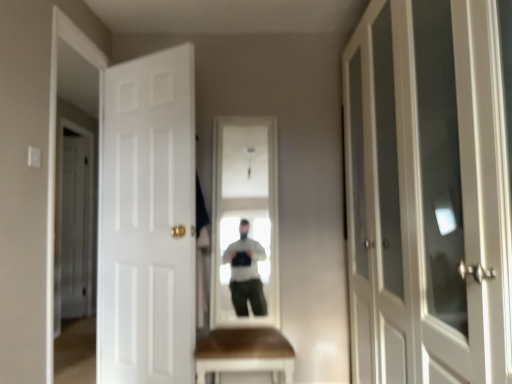
Measure the distance between white matte door at left, the 2th door positioned from the right, and camera.

A distance of 2.21 meters exists between white matte door at left, the 2th door positioned from the right, and camera.

Find the location of `white wood door at left, the third door in the front-to-back sequence`. white wood door at left, the third door in the front-to-back sequence is located at coordinates (75, 229).

Locate an element on the screen. The height and width of the screenshot is (384, 512). white matte door at left, which is the 2th door from left to right is located at coordinates (148, 221).

From the picture: What's the angular difference between white glass cabinet at right, the 3th door positioned from the back, and white wood door at left, arranged as the first door when viewed from the back,'s facing directions?

white glass cabinet at right, the 3th door positioned from the back, and white wood door at left, arranged as the first door when viewed from the back, are facing 179 degrees away from each other.

From a real-world perspective, does white glass cabinet at right, the 3th door from the left, stand above white wood door at left, the third door in the front-to-back sequence?

Yes, from a real-world perspective, white glass cabinet at right, the 3th door from the left, is on top of white wood door at left, the third door in the front-to-back sequence.

Considering the positions of points (454, 127) and (71, 243), is point (454, 127) farther from camera compared to point (71, 243)?

That is False.

How much distance is there between white glass cabinet at right, the 3th door from the left, and white wood door at left, arranged as the 3th door when viewed from the right?

white glass cabinet at right, the 3th door from the left, is 3.54 meters from white wood door at left, arranged as the 3th door when viewed from the right.

Is white glass cabinet at right, marked as the first door in a front-to-back arrangement, at the back of white wood door at left, arranged as the first door when viewed from the back?

That's not correct — white wood door at left, arranged as the first door when viewed from the back, is not looking away from white glass cabinet at right, marked as the first door in a front-to-back arrangement.

Is white wood door at left, the third door in the front-to-back sequence, smaller than white glass cabinet at right, the 3th door from the left?

Yes.

Is white wood door at left, arranged as the first door when viewed from the back, inside or outside of white glass cabinet at right, the 3th door positioned from the back?

white wood door at left, arranged as the first door when viewed from the back, is not enclosed by white glass cabinet at right, the 3th door positioned from the back.

Does white wood door at left, arranged as the 3th door when viewed from the right, come behind white glass cabinet at right, which is counted as the 1th door, starting from the right?

Yes, white wood door at left, arranged as the 3th door when viewed from the right, is behind white glass cabinet at right, which is counted as the 1th door, starting from the right.

From a real-world perspective, does white matte door at left, which ranks as the 2th door in front-to-back order, stand above white wood door at left, arranged as the 3th door when viewed from the right?

Yes, from a real-world perspective, white matte door at left, which ranks as the 2th door in front-to-back order, is on top of white wood door at left, arranged as the 3th door when viewed from the right.

From the image's perspective, who appears lower, white matte door at left, the 2th door positioned from the right, or white wood door at left, arranged as the 3th door when viewed from the right?

white wood door at left, arranged as the 3th door when viewed from the right, is shown below in the image.

Is white matte door at left, the 2th door positioned from the right, situated inside white wood door at left, arranged as the 3th door when viewed from the right, or outside?

The correct answer is: outside.

Looking at this image, considering the sizes of objects white matte door at left, which is the 2th door from left to right, and white wood door at left, arranged as the 3th door when viewed from the right, in the image provided, who is shorter, white matte door at left, which is the 2th door from left to right, or white wood door at left, arranged as the 3th door when viewed from the right,?

Standing shorter between the two is white matte door at left, which is the 2th door from left to right.

Considering the relative sizes of white wood door at left, arranged as the 3th door when viewed from the right, and white matte door at left, placed as the 2th door when sorted from back to front, in the image provided, is white wood door at left, arranged as the 3th door when viewed from the right, smaller than white matte door at left, placed as the 2th door when sorted from back to front,?

Yes, white wood door at left, arranged as the 3th door when viewed from the right, is smaller than white matte door at left, placed as the 2th door when sorted from back to front.

Based on the photo, does white wood door at left, arranged as the 3th door when viewed from the right, appear on the right side of white matte door at left, placed as the 2th door when sorted from back to front?

Incorrect, white wood door at left, arranged as the 3th door when viewed from the right, is not on the right side of white matte door at left, placed as the 2th door when sorted from back to front.

Considering the sizes of objects white wood door at left, the first door when ordered from left to right, and white matte door at left, placed as the 2th door when sorted from back to front, in the image provided, who is taller, white wood door at left, the first door when ordered from left to right, or white matte door at left, placed as the 2th door when sorted from back to front,?

With more height is white wood door at left, the first door when ordered from left to right.

Looking at their sizes, would you say white wood door at left, the first door when ordered from left to right, is wider or thinner than white matte door at left, placed as the 2th door when sorted from back to front?

In the image, white wood door at left, the first door when ordered from left to right, appears to be more narrow than white matte door at left, placed as the 2th door when sorted from back to front.

Does white glass cabinet at right, the 3th door from the left, have a smaller size compared to white matte door at left, which ranks as the 2th door in front-to-back order?

Actually, white glass cabinet at right, the 3th door from the left, might be larger than white matte door at left, which ranks as the 2th door in front-to-back order.

Does white glass cabinet at right, which is counted as the 1th door, starting from the right, appear on the right side of white matte door at left, placed as the 2th door when sorted from back to front?

Indeed, white glass cabinet at right, which is counted as the 1th door, starting from the right, is positioned on the right side of white matte door at left, placed as the 2th door when sorted from back to front.

Could you tell me if white glass cabinet at right, marked as the first door in a front-to-back arrangement, is turned towards white matte door at left, the 2th door positioned from the right?

Yes, white glass cabinet at right, marked as the first door in a front-to-back arrangement, is oriented towards white matte door at left, the 2th door positioned from the right.

Can you see white glass cabinet at right, which is counted as the 1th door, starting from the right, touching white matte door at left, placed as the 2th door when sorted from back to front?

white glass cabinet at right, which is counted as the 1th door, starting from the right, is not next to white matte door at left, placed as the 2th door when sorted from back to front, and they're not touching.

Considering the sizes of white matte door at left, which ranks as the 2th door in front-to-back order, and white glass cabinet at right, the 3th door positioned from the back, in the image, is white matte door at left, which ranks as the 2th door in front-to-back order, wider or thinner than white glass cabinet at right, the 3th door positioned from the back,?

In the image, white matte door at left, which ranks as the 2th door in front-to-back order, appears to be more narrow than white glass cabinet at right, the 3th door positioned from the back.

Is white matte door at left, which is the 2th door from left to right, inside the boundaries of white glass cabinet at right, which is counted as the 1th door, starting from the right, or outside?

white matte door at left, which is the 2th door from left to right, is outside white glass cabinet at right, which is counted as the 1th door, starting from the right.

Can you tell me how much white matte door at left, the 2th door positioned from the right, and white glass cabinet at right, marked as the first door in a front-to-back arrangement, differ in facing direction?

The angle between the facing direction of white matte door at left, the 2th door positioned from the right, and the facing direction of white glass cabinet at right, marked as the first door in a front-to-back arrangement, is 56.3 degrees.

From a real-world perspective, who is located higher, white matte door at left, the 2th door positioned from the right, or white glass cabinet at right, which is counted as the 1th door, starting from the right?

In real-world perspective, white glass cabinet at right, which is counted as the 1th door, starting from the right, is above.

Where is `the 2nd door directly above the white wood door at left, arranged as the first door when viewed from the back (from a real-world perspective)`? This screenshot has height=384, width=512. the 2nd door directly above the white wood door at left, arranged as the first door when viewed from the back (from a real-world perspective) is located at coordinates (430, 191).

From a real-world perspective, which door is the 2nd one underneath the white glass cabinet at right, the 3th door from the left? Please provide its 2D coordinates.

[(75, 229)]

Based on the photo, looking at the image, which one is located further to white glass cabinet at right, marked as the first door in a front-to-back arrangement, white matte door at left, which is the 2th door from left to right, or white wood door at left, the third door in the front-to-back sequence?

white wood door at left, the third door in the front-to-back sequence.

Based on their spatial positions, is white wood door at left, the first door when ordered from left to right, or white matte door at left, which is the 2th door from left to right, further from white glass cabinet at right, the 3th door from the left?

Based on the image, white wood door at left, the first door when ordered from left to right, appears to be further to white glass cabinet at right, the 3th door from the left.

When comparing their distances from white wood door at left, the third door in the front-to-back sequence, does white matte door at left, which is the 2th door from left to right, or white glass cabinet at right, the 3th door from the left, seem closer?

white matte door at left, which is the 2th door from left to right, lies closer to white wood door at left, the third door in the front-to-back sequence, than the other object.

In the scene shown: Looking at the image, which one is located further to white matte door at left, placed as the 2th door when sorted from back to front, white wood door at left, arranged as the first door when viewed from the back, or white glass cabinet at right, the 3th door positioned from the back?

white wood door at left, arranged as the first door when viewed from the back, is positioned further to the anchor white matte door at left, placed as the 2th door when sorted from back to front.

Which object lies nearer to the anchor point white wood door at left, arranged as the 3th door when viewed from the right, white glass cabinet at right, the 3th door positioned from the back, or white matte door at left, placed as the 2th door when sorted from back to front?

white matte door at left, placed as the 2th door when sorted from back to front.

When comparing their distances from white matte door at left, placed as the 2th door when sorted from back to front, does white glass cabinet at right, which is counted as the 1th door, starting from the right, or white wood door at left, arranged as the 3th door when viewed from the right, seem closer?

white glass cabinet at right, which is counted as the 1th door, starting from the right, is closer to white matte door at left, placed as the 2th door when sorted from back to front.

You are a GUI agent. You are given a task and a screenshot of the screen. Output one action in this format:
    pyautogui.click(x=<x>, y=<y>)
    Task: Click on the door between white glass cabinet at right, the 3th door positioned from the back, and white wood door at left, arranged as the 3th door when viewed from the right, from front to back
    The image size is (512, 384).
    Given the screenshot: What is the action you would take?
    pyautogui.click(x=148, y=221)